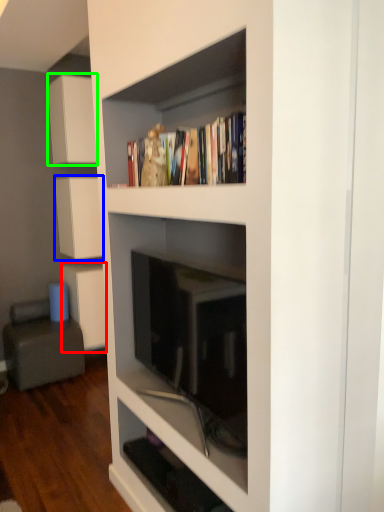
Question: Which object is positioned farthest from cabinetry (highlighted by a red box)? Select from cabinetry (highlighted by a blue box) and cabinetry (highlighted by a green box).

Choices:
 (A) cabinetry
 (B) cabinetry

Answer: (B)